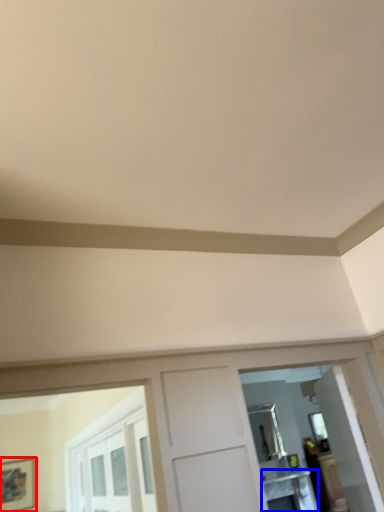
Question: Which of the following is the farthest to the observer, picture frame (highlighted by a red box) or table (highlighted by a blue box)?

Choices:
 (A) picture frame
 (B) table

Answer: (B)